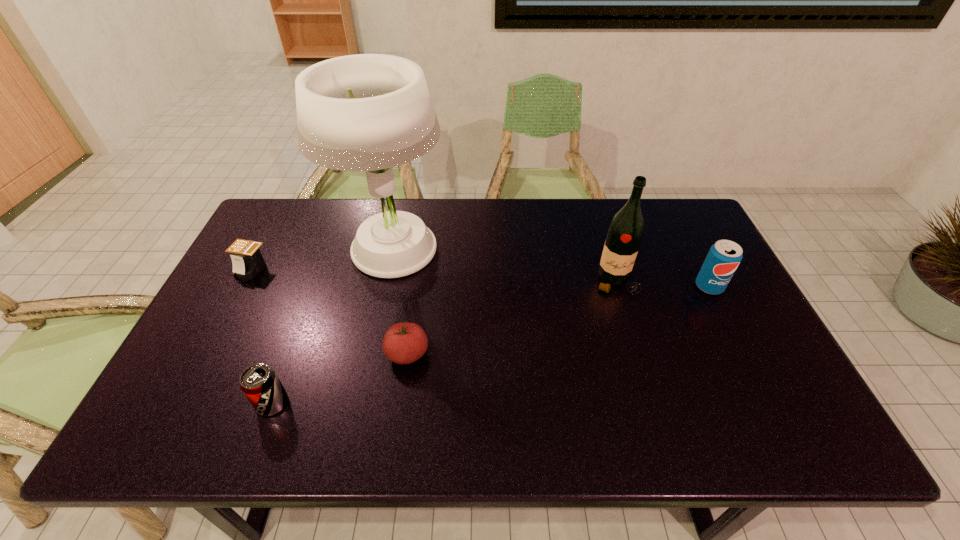
Find the location of a particular element. This screenshot has width=960, height=540. vacant region between the tallest object and the fifth farthest object is located at coordinates (399, 302).

Where is `vacant region between the leftmost object and the lamp`? vacant region between the leftmost object and the lamp is located at coordinates (322, 260).

Locate an element on the screen. This screenshot has width=960, height=540. unoccupied position between the tallest object and the tomato is located at coordinates (399, 302).

Where is `blank region between the second nearest object and the fifth shortest object`? blank region between the second nearest object and the fifth shortest object is located at coordinates (512, 318).

This screenshot has height=540, width=960. Identify the location of free space between the tomato and the lamp. (399, 302).

Locate an element on the screen. The height and width of the screenshot is (540, 960). vacant space that's between the lamp and the second tallest object is located at coordinates (504, 266).

Find the location of `object that stands as the fifth closest to the right soda can`. object that stands as the fifth closest to the right soda can is located at coordinates (247, 259).

Identify which object is the fifth nearest to the fifth shortest object. Please provide its 2D coordinates. Your answer should be formatted as a tuple, i.e. [(x, y)], where the tuple contains the x and y coordinates of a point satisfying the conditions above.

[(247, 259)]

Locate an element on the screen. Image resolution: width=960 pixels, height=540 pixels. free space in the image that satisfies the following two spatial constraints: 1. on the front-facing side of the rightmost object; 2. on the left side of the lamp is located at coordinates (384, 287).

Locate an element on the screen. The width and height of the screenshot is (960, 540). vacant space that satisfies the following two spatial constraints: 1. on the surface of the fifth object from left to right; 2. on the left side of the rightmost object is located at coordinates (618, 287).